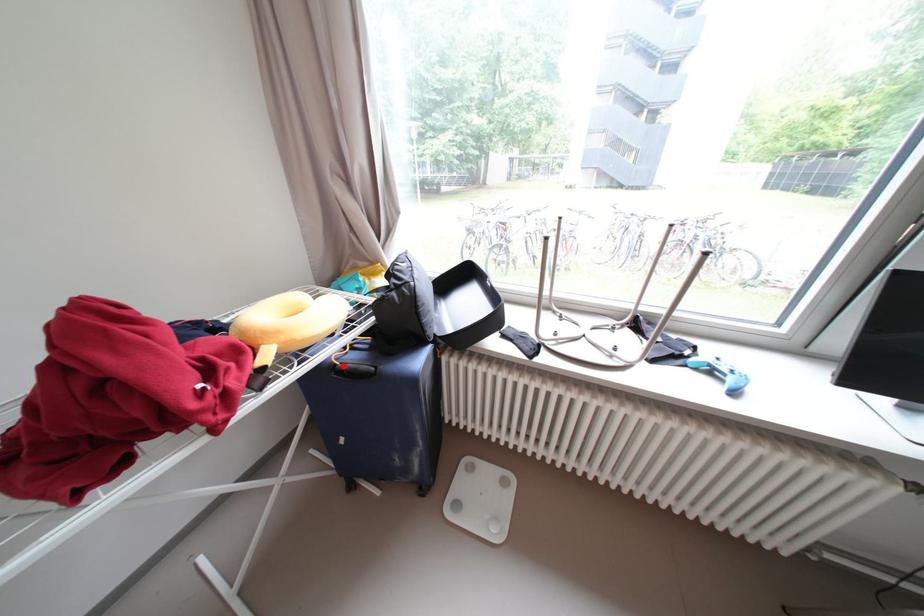
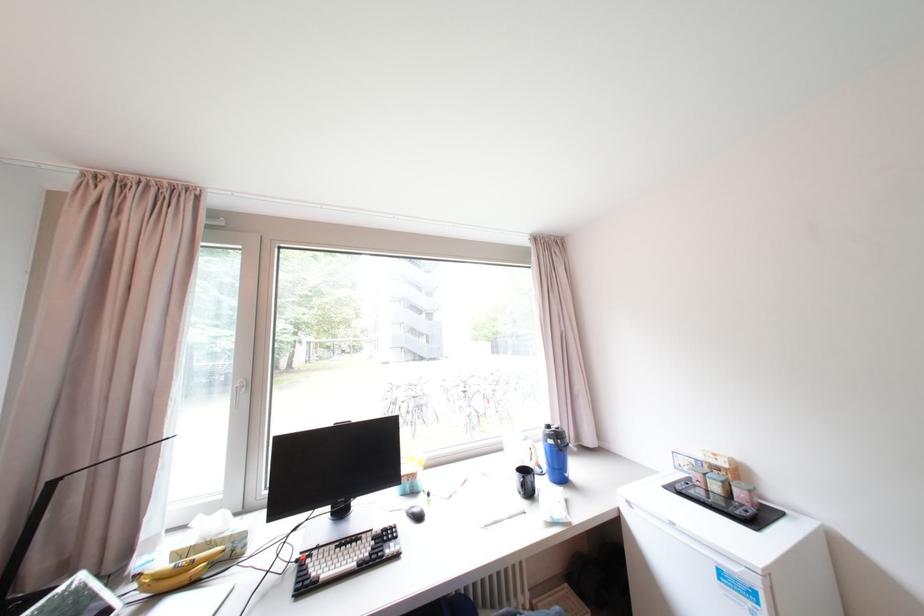
Question: I am providing you with two images of the same scene from different viewpoints. A red point is marked on the first image. Is the red point's position out of view in image 2?

Choices:
 (A) Yes
 (B) No

Answer: (A)